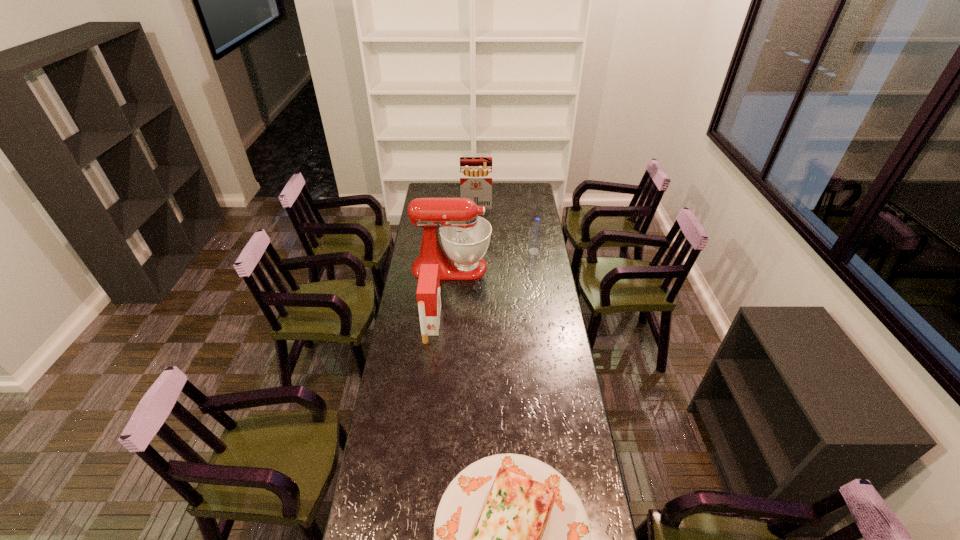
Find the location of a particular element. The height and width of the screenshot is (540, 960). the second closest object to the taller cigarette case is located at coordinates (535, 239).

Identify which object is located as the fourth nearest to the lasagna. Please provide its 2D coordinates. Your answer should be formatted as a tuple, i.e. [(x, y)], where the tuple contains the x and y coordinates of a point satisfying the conditions above.

[(475, 172)]

What are the coordinates of `vacant space that satisfies the following two spatial constraints: 1. with the lid open on the farther cigarette case; 2. on the front-facing side of the nearer cigarette case` in the screenshot? It's located at (475, 323).

The height and width of the screenshot is (540, 960). What are the coordinates of `vacant space that satisfies the following two spatial constraints: 1. on the front side of the water bottle; 2. at the attachment hub of the mixer` in the screenshot? It's located at (537, 267).

This screenshot has width=960, height=540. I want to click on vacant area that satisfies the following two spatial constraints: 1. with the lid open on the farthest object; 2. on the front-facing side of the nearer cigarette case, so click(x=475, y=323).

Where is `free location that satisfies the following two spatial constraints: 1. with the lid open on the taller cigarette case; 2. on the front-facing side of the second nearest object`? The image size is (960, 540). free location that satisfies the following two spatial constraints: 1. with the lid open on the taller cigarette case; 2. on the front-facing side of the second nearest object is located at coordinates (475, 323).